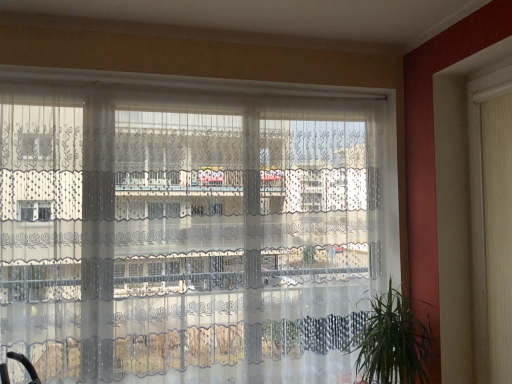
Question: Does green leafy plant at lower right appear on the right side of white fabric shutter at right?

Choices:
 (A) no
 (B) yes

Answer: (A)

Question: From the image's perspective, is green leafy plant at lower right on white fabric shutter at right?

Choices:
 (A) yes
 (B) no

Answer: (B)

Question: Is green leafy plant at lower right facing towards white fabric shutter at right?

Choices:
 (A) yes
 (B) no

Answer: (B)

Question: From the image's perspective, is green leafy plant at lower right located beneath white fabric shutter at right?

Choices:
 (A) no
 (B) yes

Answer: (B)

Question: Is white fabric shutter at right located within green leafy plant at lower right?

Choices:
 (A) no
 (B) yes

Answer: (A)

Question: From a real-world perspective, is transparent lace curtains at center positioned above or below white fabric shutter at right?

Choices:
 (A) above
 (B) below

Answer: (B)

Question: Considering the positions of transparent lace curtains at center and white fabric shutter at right in the image, is transparent lace curtains at center taller or shorter than white fabric shutter at right?

Choices:
 (A) tall
 (B) short

Answer: (A)

Question: Is transparent lace curtains at center wider or thinner than white fabric shutter at right?

Choices:
 (A) thin
 (B) wide

Answer: (B)

Question: Is transparent lace curtains at center bigger or smaller than white fabric shutter at right?

Choices:
 (A) small
 (B) big

Answer: (B)

Question: From a real-world perspective, is green leafy plant at lower right physically located above or below transparent lace curtains at center?

Choices:
 (A) above
 (B) below

Answer: (B)

Question: Which is correct: green leafy plant at lower right is inside transparent lace curtains at center, or outside of it?

Choices:
 (A) outside
 (B) inside

Answer: (A)

Question: In terms of size, does green leafy plant at lower right appear bigger or smaller than transparent lace curtains at center?

Choices:
 (A) small
 (B) big

Answer: (A)

Question: Considering the positions of point (425, 377) and point (373, 263), is point (425, 377) closer or farther from the camera than point (373, 263)?

Choices:
 (A) farther
 (B) closer

Answer: (B)

Question: Would you say white fabric shutter at right is to the left or to the right of green leafy plant at lower right in the picture?

Choices:
 (A) left
 (B) right

Answer: (B)

Question: Would you say white fabric shutter at right is inside or outside green leafy plant at lower right?

Choices:
 (A) outside
 (B) inside

Answer: (A)